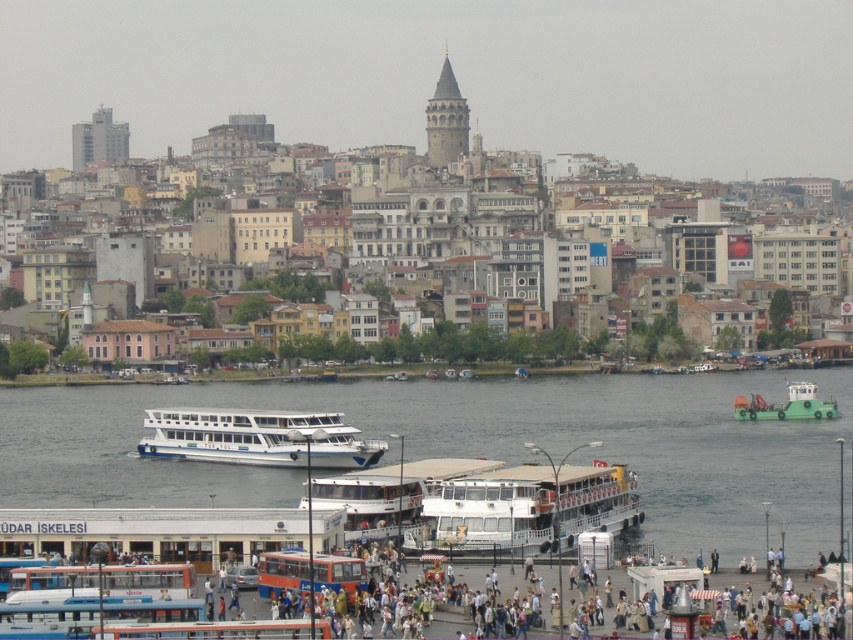
You are standing on the walkway at the waterfront in Istanbul, near the Galata Tower. You see a point marked at coordinates (621, 493). If you want to reach this point quickly, which direction should you move relative to your current position?

The point at coordinates (621, 493) is 146.90 meters away from you. To reach it quickly, move directly towards it, which would be the shortest path.

You are standing on the walkway at the waterfront and see the white matte ferry at center. If you want to board the ferry, which is 131.77 meters away, can you walk there in 2 minutes if your walking speed is 1.5 meters per second?

The white matte ferry at center is 131.77 meters away from viewer. At a walking speed of 1.5 meters per second, it would take approximately 87.8 seconds, which is about 1.46 minutes. Therefore, you can reach the ferry in less than 2 minutes.

You are standing on the walkway near the harbor and want to take a photo of the blue water at center. According to the coordinates provided, where should you aim your camera?

The blue water at center is located at coordinates point (469, 445), so aim your camera there.